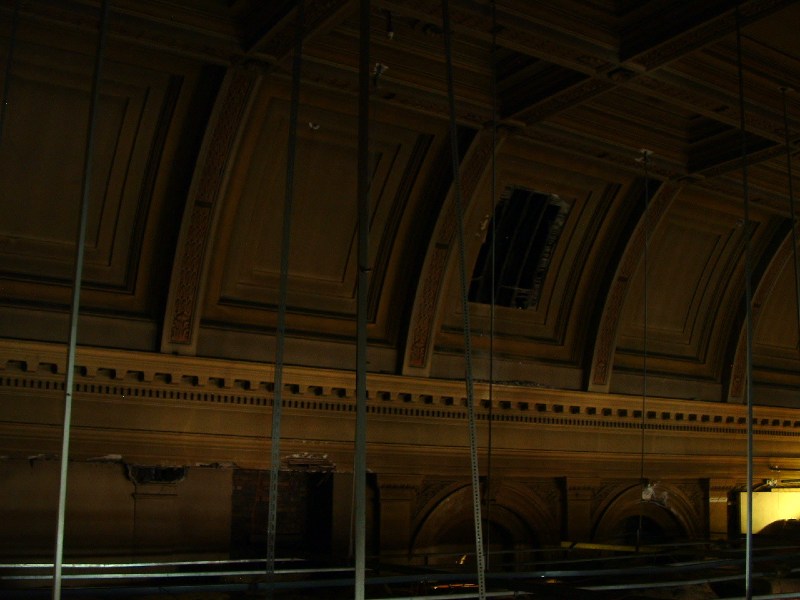
This screenshot has width=800, height=600. In order to click on ledge between lower wall and upper wall in this screenshot , I will do `click(241, 361)`.